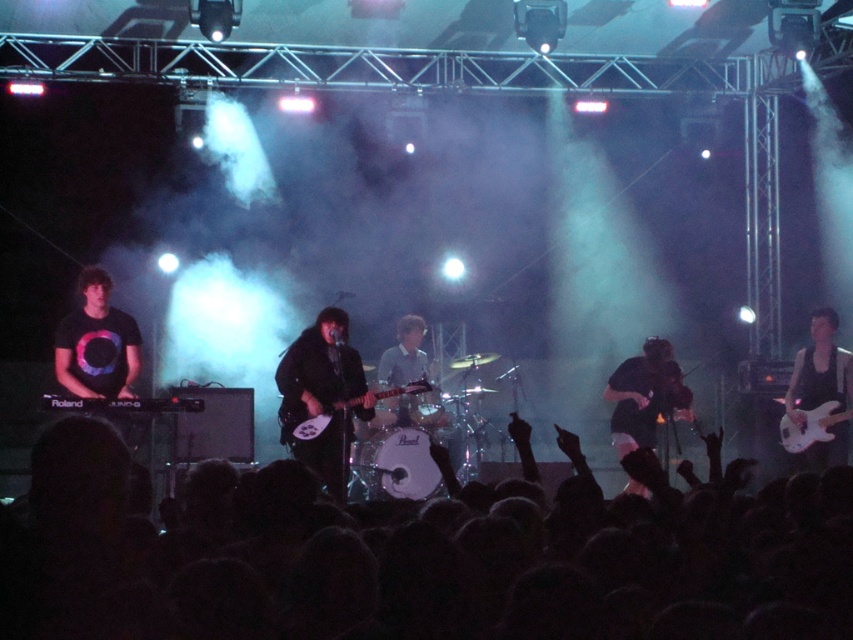
You are a photographer at the back of the venue trying to capture a clear photo of the black hair at lower center and the glossy white guitar at center. Based on their positions, which object is closer to the camera?

The black hair at lower center is closer to the camera because it is positioned below the glossy white guitar at center, indicating it is in a lower and thus nearer position from the photographer viewpoint.